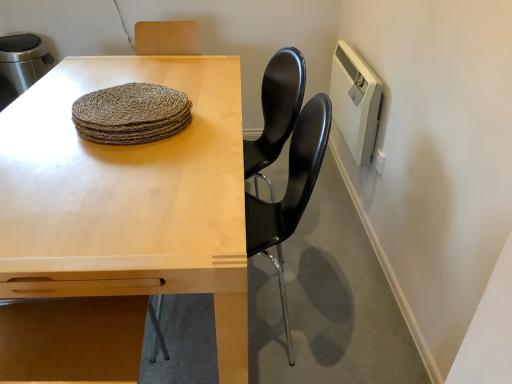
Identify the location of empty space that is ontop of light wood table at center (from a real-world perspective). The image size is (512, 384). (112, 150).